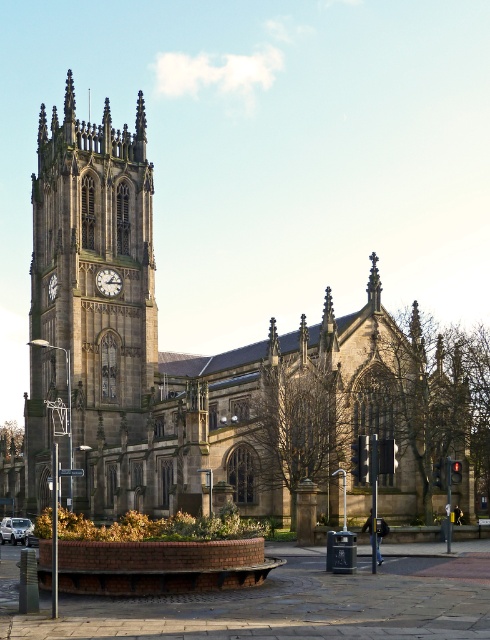
Consider the image. You are standing in front of the brown stone church at center and the stone clock tower at center. Which structure is closer to you?

The brown stone church at center is closer to the viewer than the stone clock tower at center.